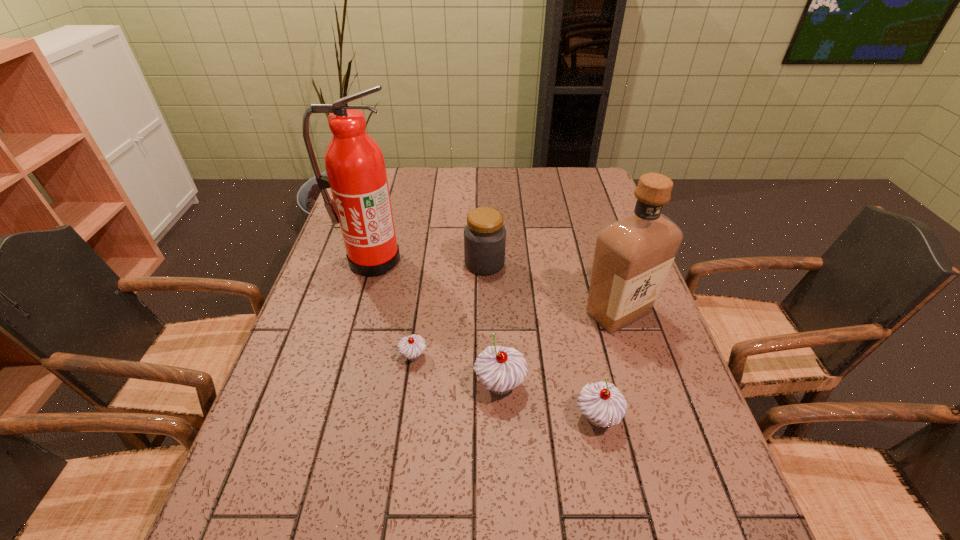
Find the location of a particular element. vacant space located on the right of the second cupcake from right to left is located at coordinates (635, 385).

Where is `vacant space located 0.300m on the left of the second shortest cupcake`? The image size is (960, 540). vacant space located 0.300m on the left of the second shortest cupcake is located at coordinates (430, 417).

Where is `vacant space located on the front-facing side of the fourth nearest object`? The width and height of the screenshot is (960, 540). vacant space located on the front-facing side of the fourth nearest object is located at coordinates (675, 490).

Find the location of `vacant space located 0.090m on the surface of the jar near the warning symbol`. vacant space located 0.090m on the surface of the jar near the warning symbol is located at coordinates (434, 264).

You are a GUI agent. You are given a task and a screenshot of the screen. Output one action in this format:
    pyautogui.click(x=<x>, y=<y>)
    Task: Click on the free spot located on the surface of the jar near the warning symbol
    
    Given the screenshot: What is the action you would take?
    pyautogui.click(x=410, y=264)

Find the location of a particular element. vacant space located on the surface of the jar near the warning symbol is located at coordinates (393, 264).

The image size is (960, 540). I want to click on vacant area situated 0.060m on the label side of the fire extinguisher, so click(363, 292).

You are a GUI agent. You are given a task and a screenshot of the screen. Output one action in this format:
    pyautogui.click(x=<x>, y=<y>)
    Task: Click on the object present at the left edge
    This screenshot has height=540, width=960.
    Given the screenshot: What is the action you would take?
    pyautogui.click(x=356, y=173)

This screenshot has width=960, height=540. Find the location of `cupcake situated at the right edge`. cupcake situated at the right edge is located at coordinates (603, 404).

I want to click on liquor located in the right edge section of the desktop, so click(633, 255).